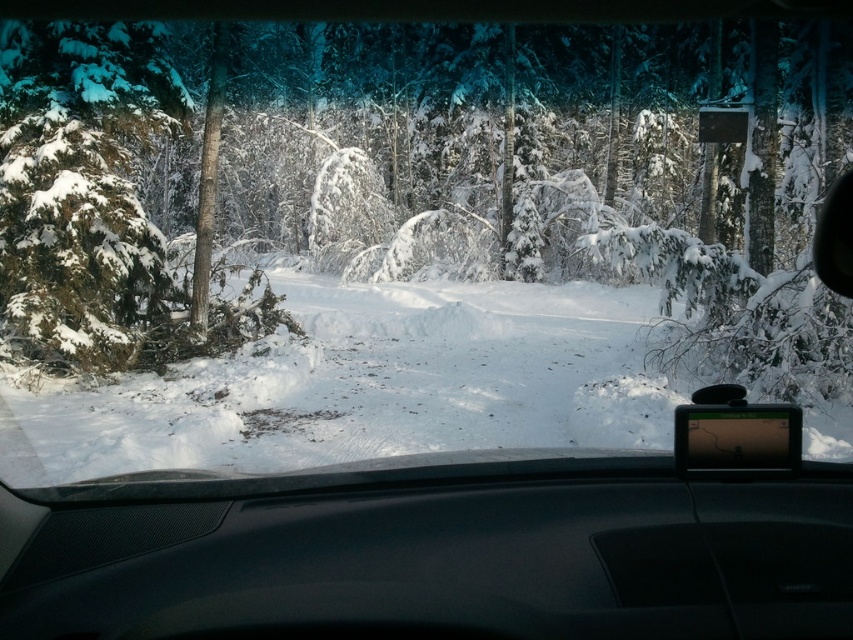
Based on the photo, you are driving in a snowstorm and need to check your GPS. Can you see the white fluffy snow at center through the black matte dashboard at center?

The black matte dashboard at center is in front of white fluffy snow at center, so you cannot see the white fluffy snow at center through the black matte dashboard at center.

Based on the photo, you are a passenger in the car and want to know which object is smaller between the black matte dashboard at center and the white fluffy snow at center. Can you determine this based on their sizes?

The black matte dashboard at center has a smaller size compared to white fluffy snow at center, so the black matte dashboard at center is smaller.

You are sitting in the car and looking at the snowy landscape outside. There are two points marked on the windshield at coordinates point (782, 481) and point (440, 284). Which point is closer to you?

Point (782, 481) is closer to the viewer than point (440, 284).